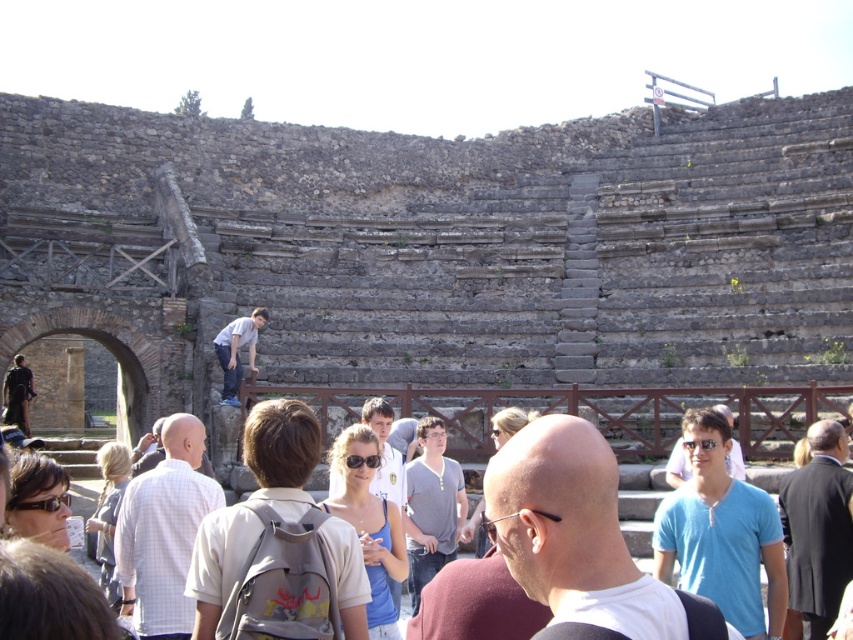
Question: Which object appears farthest from the camera in this image?

Choices:
 (A) matte blue tank top at center
 (B) blue cotton shirt at center
 (C) light brown hair at lower left
 (D) black suit jacket at center

Answer: (C)

Question: Does gray cotton shirt at center lie in front of light brown hair at lower left?

Choices:
 (A) yes
 (B) no

Answer: (B)

Question: Among these points, which one is farthest from the camera?

Choices:
 (A) (474, 534)
 (B) (368, 438)
 (C) (799, 538)

Answer: (A)

Question: Among these objects, which one is farthest from the camera?

Choices:
 (A) black suit jacket at center
 (B) matte blue tank top at center

Answer: (B)

Question: Observing the image, what is the correct spatial positioning of matte black sunglasses at lower left in reference to matte gray hoodie at center?

Choices:
 (A) left
 (B) right

Answer: (A)

Question: Does blue cotton shirt at center have a greater width compared to matte blue tank top at center?

Choices:
 (A) no
 (B) yes

Answer: (B)